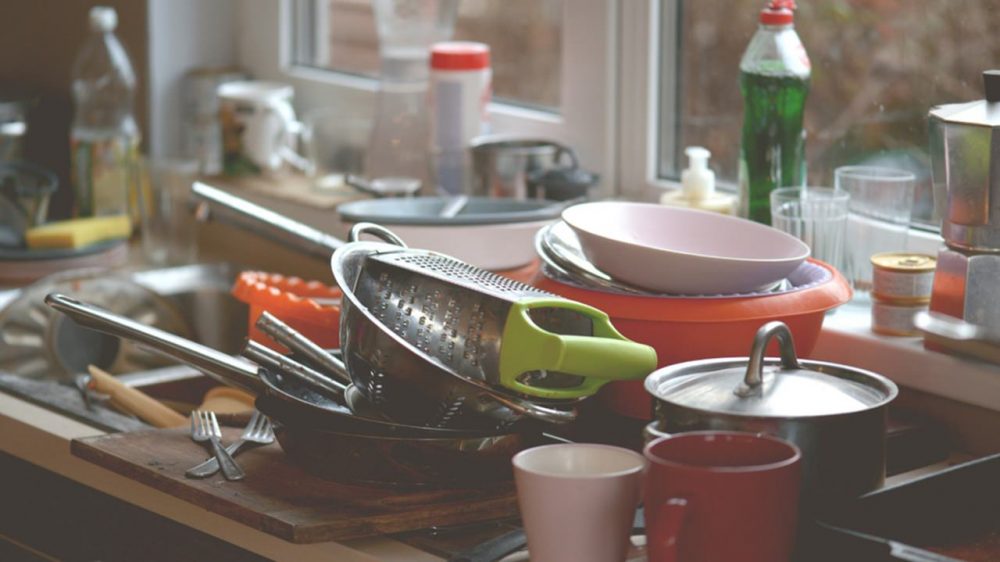
Locate an element on the screen. The image size is (1000, 562). dish is located at coordinates (489, 215), (463, 238), (680, 238), (587, 260), (551, 262).